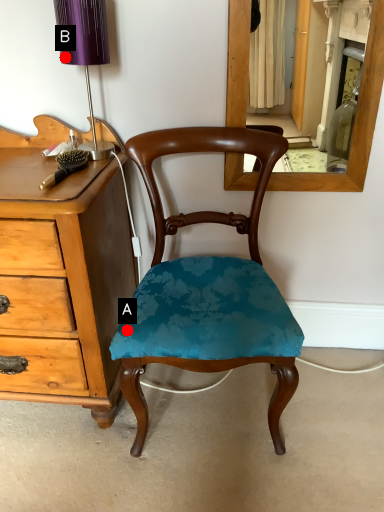
Question: Two points are circled on the image, labeled by A and B beside each circle. Which point is closer to the camera?

Choices:
 (A) A is closer
 (B) B is closer

Answer: (A)